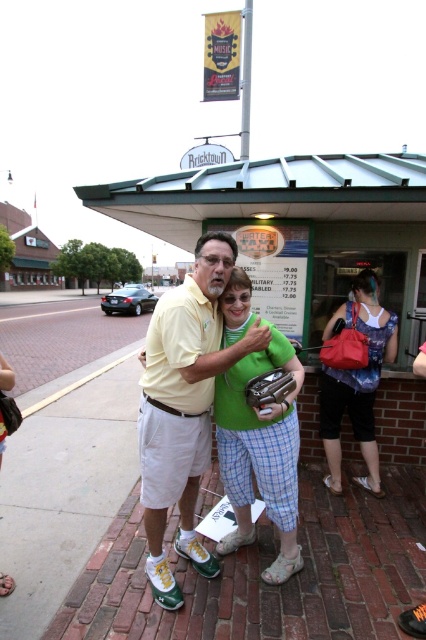
Between yellow cotton shirt at center and matte blue dress at center, which one has more height?

With more height is yellow cotton shirt at center.

At what (x,y) coordinates should I click in order to perform the action: click on yellow cotton shirt at center. Please return your answer as a coordinate pair (x, y). This screenshot has width=426, height=640. Looking at the image, I should click on (184, 401).

Is green fabric purse at center to the right of matte blue dress at center from the viewer's perspective?

Incorrect, green fabric purse at center is not on the right side of matte blue dress at center.

Who is higher up, green fabric purse at center or matte blue dress at center?

matte blue dress at center is above.

This screenshot has width=426, height=640. Identify the location of green fabric purse at center. (258, 435).

Where is `green fabric purse at center`? This screenshot has height=640, width=426. green fabric purse at center is located at coordinates (258, 435).

Between yellow cotton shirt at center and green fabric purse at center, which one appears on the left side from the viewer's perspective?

yellow cotton shirt at center is more to the left.

Measure the distance between yellow cotton shirt at center and camera.

The distance of yellow cotton shirt at center from camera is 6.82 feet.

I want to click on yellow cotton shirt at center, so click(x=184, y=401).